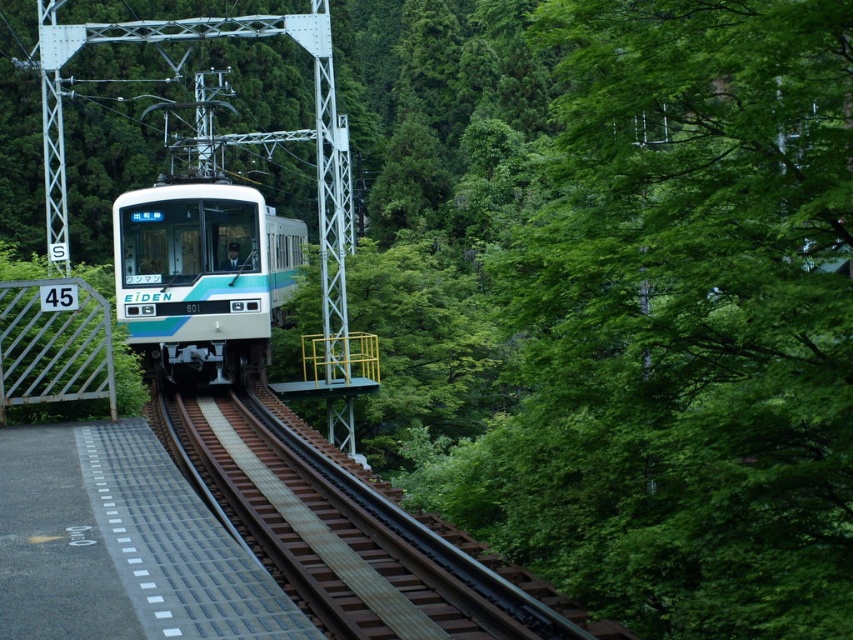
You are a maintenance worker responsible for inspecting the brown wooden train track at center and the teal glossy train at center. Your tool kit is 1.5 meters long. If you place the tool kit horizontally between the two objects, will it reach from one to the other without any part hanging off?

The brown wooden train track at center is 6.40 meters from the teal glossy train at center. Since the tool kit is only 1.5 meters long, it will not be long enough to span the distance between them. Therefore, the tool kit will not reach from one to the other without part of it hanging off.

You are a maintenance worker checking the length of the brown wooden train track at center and the teal glossy train at center. Which object is longer?

The teal glossy train at center is longer than the brown wooden train track at center.